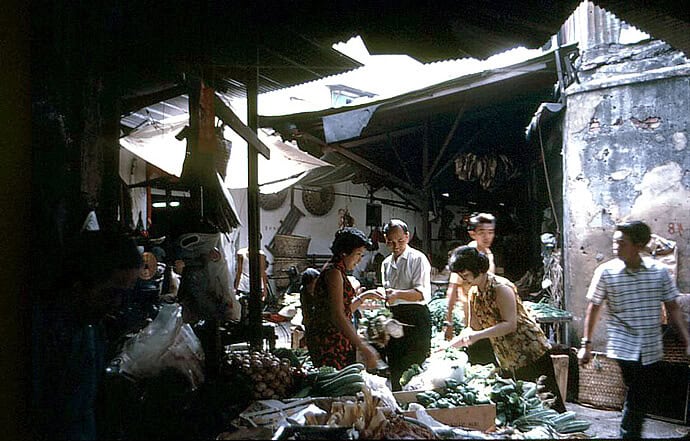
What are the coordinates of `wicker basket` in the screenshot? It's located at (604, 391), (669, 351), (293, 251), (277, 274).